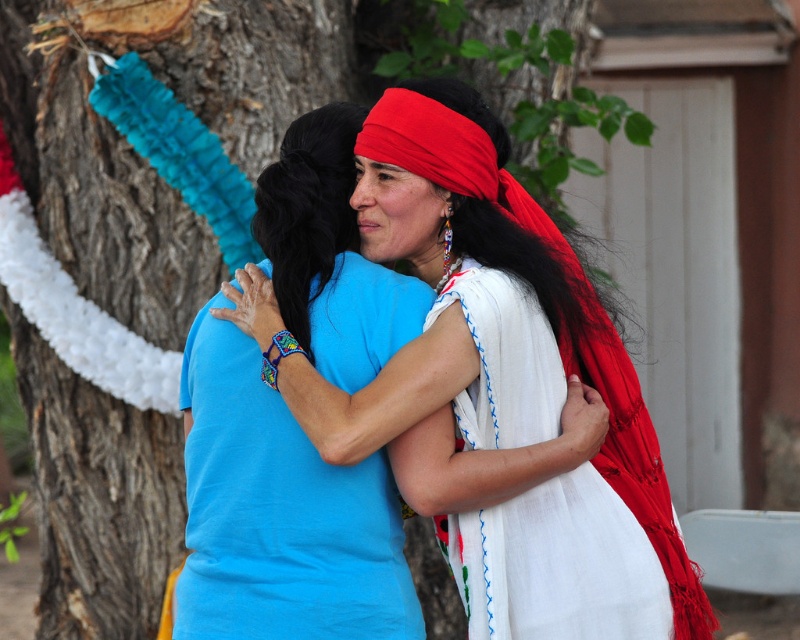
You are an artist trying to sketch this scene. You need to place the white embroidered dress at center in your drawing. What are the coordinates for its position?

The white embroidered dress at center should be placed at coordinates 0.881 on the x axis and 0.700 on the y axis.